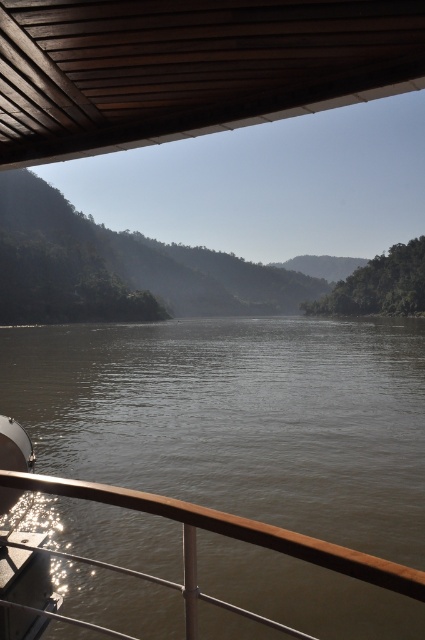
In the scene shown: Which of these two, brown wooden deck at upper center or metal/rustic rail at lower left, stands shorter?

brown wooden deck at upper center

Between brown wooden deck at upper center and metal/rustic rail at lower left, which one appears on the right side from the viewer's perspective?

metal/rustic rail at lower left is more to the right.

Does point (141, 42) come closer to viewer compared to point (22, 474)?

No, it is not.

Where is `brown wooden deck at upper center`? The image size is (425, 640). brown wooden deck at upper center is located at coordinates (189, 67).